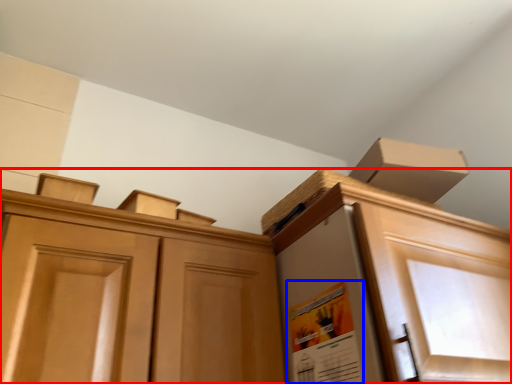
Question: Which object is closer to the camera taking this photo, cabinetry (highlighted by a red box) or poster (highlighted by a blue box)?

Choices:
 (A) cabinetry
 (B) poster

Answer: (A)